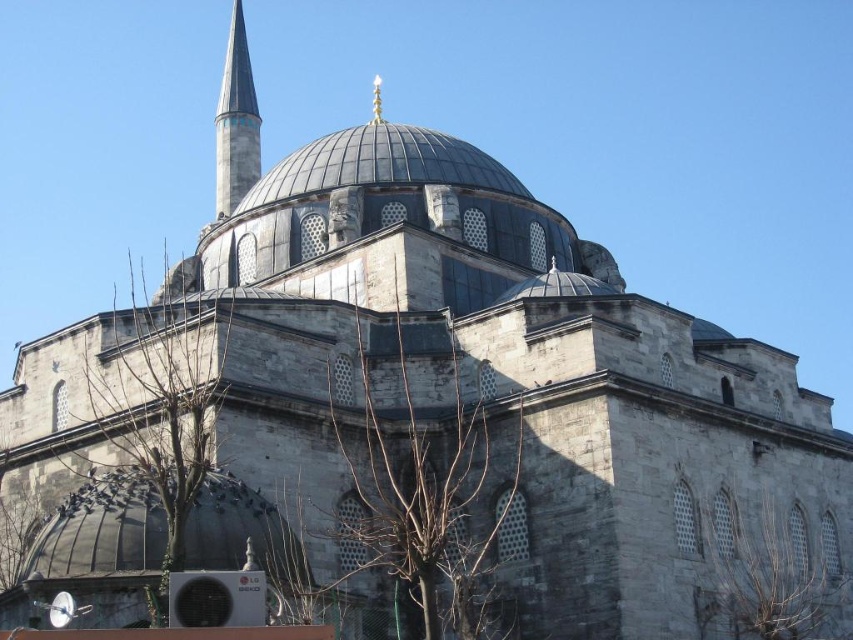
You are a tourist standing in front of the mosque and want to take a photo that includes both the gray stone dome at center and the smooth white minaret at upper left. Based on their positions, which object should you place on the right side of your photo frame?

The gray stone dome at center should be placed on the right side of your photo frame because it is positioned on the right side of the smooth white minaret at upper left.

You are an architect analyzing the mosque structure. You notice the gray stone dome at center and the smooth white minaret at upper left. Which of these two structures is larger in size?

The gray stone dome at center is smaller than the smooth white minaret at upper left, so the smooth white minaret at upper left is larger in size.

From the picture: You are an architect analyzing the mosque structure. Based on the image, which object has a smaller width between the gray stone dome at center and the smooth white minaret at upper left?

The gray stone dome at center has a smaller width compared to the smooth white minaret at upper left.